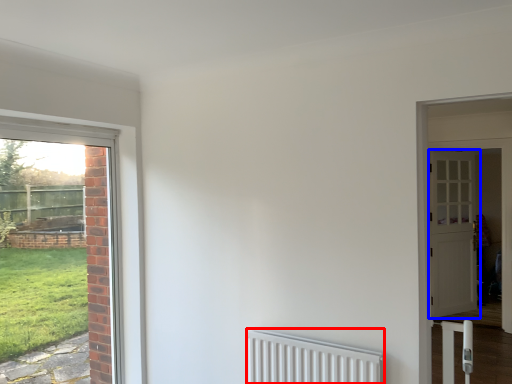
Question: Which point is closer to the camera, radiator (highlighted by a red box) or door (highlighted by a blue box)?

Choices:
 (A) radiator
 (B) door

Answer: (A)